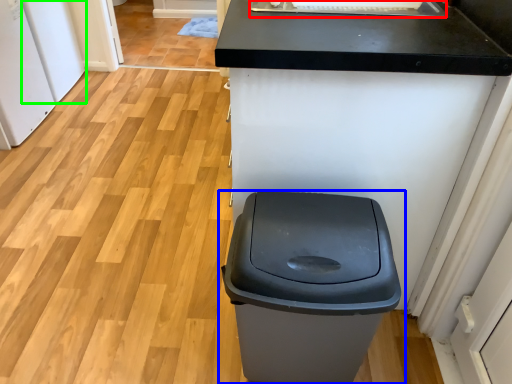
Question: Which is nearer to the sink (highlighted by a red box)? waste container (highlighted by a blue box) or appliance (highlighted by a green box).

Choices:
 (A) waste container
 (B) appliance

Answer: (A)